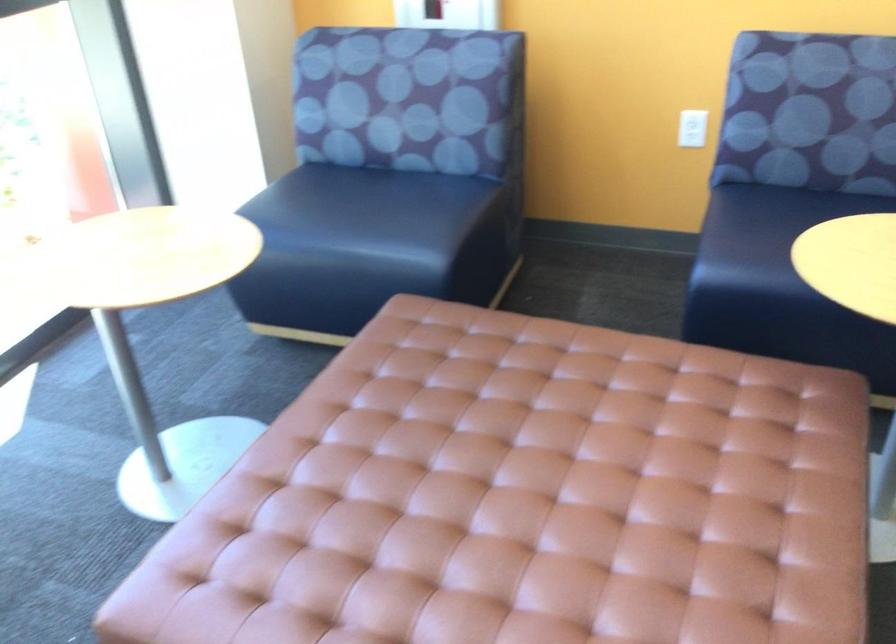
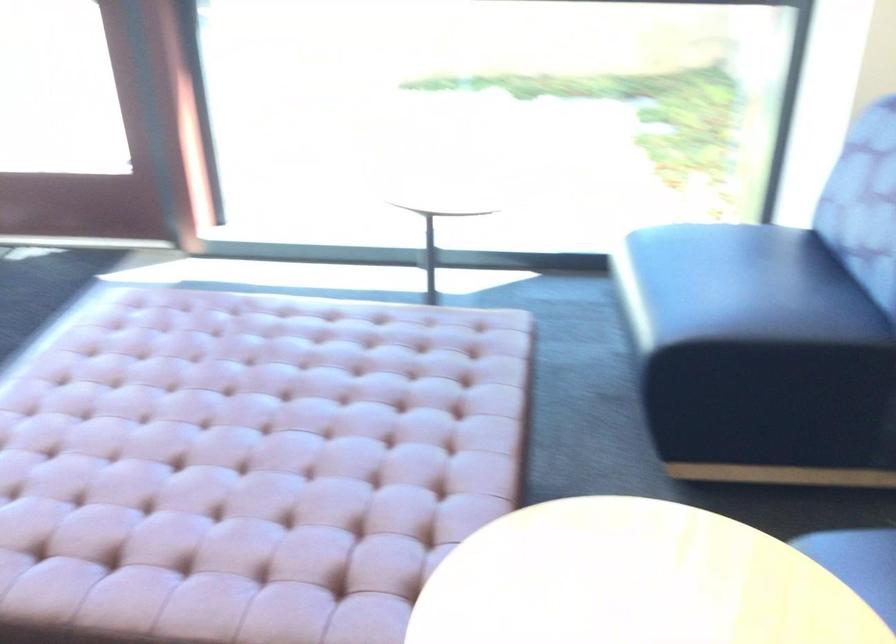
Locate, in the second image, the point that corresponds to point 513,426 in the first image.

(306, 406)